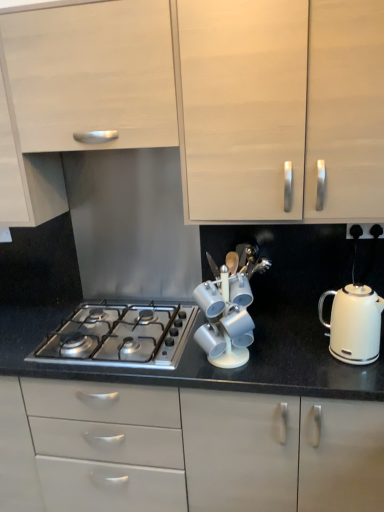
The height and width of the screenshot is (512, 384). What are the coordinates of `vacant region in front of white glossy kettle at right` in the screenshot? It's located at (349, 380).